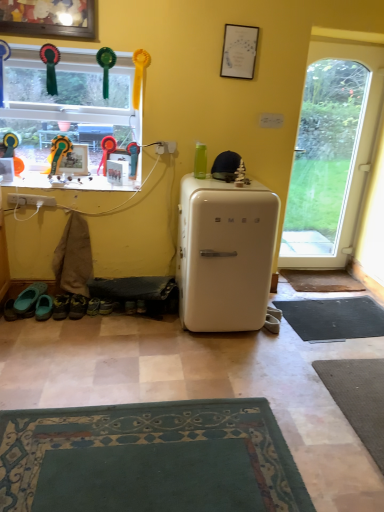
The image size is (384, 512). Find the location of `glass window at upper left`. glass window at upper left is located at coordinates (67, 112).

Measure the distance between point (131, 159) and camera.

The distance of point (131, 159) from camera is 3.19 meters.

The height and width of the screenshot is (512, 384). What do you see at coordinates (225, 254) in the screenshot?
I see `white matte refrigerator at center` at bounding box center [225, 254].

This screenshot has width=384, height=512. Find the location of `rubber ribbon at upper left, the 2th toy in the right-to-left sequence`. rubber ribbon at upper left, the 2th toy in the right-to-left sequence is located at coordinates (106, 151).

Locate an element on the screen. The image size is (384, 512). transparent glass door at right is located at coordinates (331, 151).

From the image's perspective, which is above, green fabric shoe at lower left, which is the first shoe in right-to-left order, or black rubber doormat at lower right?

green fabric shoe at lower left, which is the first shoe in right-to-left order, from the image's perspective.

Is green fabric shoe at lower left, the 2th shoe when ordered from left to right, aimed at black rubber doormat at lower right?

No, green fabric shoe at lower left, the 2th shoe when ordered from left to right, is not turned towards black rubber doormat at lower right.

From a real-world perspective, is green fabric shoe at lower left, which is the first shoe in right-to-left order, physically below black rubber doormat at lower right?

No, from a real-world perspective, green fabric shoe at lower left, which is the first shoe in right-to-left order, is not below black rubber doormat at lower right.

Between green fabric shoe at lower left, which is the first shoe in right-to-left order, and black rubber doormat at lower right, which one has less height?

black rubber doormat at lower right is shorter.

Which point is more distant from viewer, (281,274) or (67,153)?

Point (281,274)

What's the angular difference between brown textured mat at lower right and wooden photo frame at upper left, the 2th picture frame in the front-to-back sequence,'s facing directions?

The facing directions of brown textured mat at lower right and wooden photo frame at upper left, the 2th picture frame in the front-to-back sequence, are 0.535 degrees apart.

How much distance is there between brown textured mat at lower right and wooden photo frame at upper left, which is counted as the second picture frame, starting from the top?

brown textured mat at lower right is 6.91 feet from wooden photo frame at upper left, which is counted as the second picture frame, starting from the top.

Which of these two, brown textured mat at lower right or wooden photo frame at upper left, which is counted as the second picture frame, starting from the top, is thinner?

wooden photo frame at upper left, which is counted as the second picture frame, starting from the top, is thinner.

Does green rubber clogs at lower left, arranged as the first footwear when viewed from the left, lie behind green fabric shoe at lower left, which is the first shoe in right-to-left order?

That is False.

Between point (41, 282) and point (145, 311), which one is positioned behind?

Point (41, 282)

Could green fabric shoe at lower left, which is the first shoe in right-to-left order, be considered to be inside green rubber clogs at lower left, the third footwear positioned from the right?

No, green fabric shoe at lower left, which is the first shoe in right-to-left order, is located outside of green rubber clogs at lower left, the third footwear positioned from the right.

Based on the photo, looking at their sizes, would you say green rubber clogs at lower left, arranged as the first footwear when viewed from the left, is wider or thinner than green fabric shoe at lower left, which is the first shoe in right-to-left order?

Considering their sizes, green rubber clogs at lower left, arranged as the first footwear when viewed from the left, looks broader than green fabric shoe at lower left, which is the first shoe in right-to-left order.

Considering the sizes of objects teal fabric shoes at lower left, arranged as the second footwear when viewed from the left, and metallic green ribbon at upper left, acting as the third toy starting from the right, in the image provided, who is bigger, teal fabric shoes at lower left, arranged as the second footwear when viewed from the left, or metallic green ribbon at upper left, acting as the third toy starting from the right,?

metallic green ribbon at upper left, acting as the third toy starting from the right, is bigger.

Looking at this image, is teal fabric shoes at lower left, which is counted as the second footwear, starting from the right, facing away from metallic green ribbon at upper left, acting as the third toy starting from the right?

teal fabric shoes at lower left, which is counted as the second footwear, starting from the right, is not turned away from metallic green ribbon at upper left, acting as the third toy starting from the right.

This screenshot has height=512, width=384. I want to click on the 3rd footwear located beneath the metallic green ribbon at upper left, acting as the third toy starting from the right (from a real-world perspective), so click(44, 307).

Measure the distance from transparent glass door at right to black rubber doormat at lower right.

The distance of transparent glass door at right from black rubber doormat at lower right is 4.04 feet.

From a real-world perspective, which is physically above, transparent glass door at right or black rubber doormat at lower right?

In real-world perspective, transparent glass door at right is above.

Are transparent glass door at right and black rubber doormat at lower right making contact?

transparent glass door at right is not next to black rubber doormat at lower right, and they're not touching.

Is point (307, 148) closer to viewer compared to point (298, 322)?

No, it is not.

From the image's perspective, between black rubber doormat at lower right and teal fabric shoes at lower left, which is counted as the second footwear, starting from the right, which one is located above?

teal fabric shoes at lower left, which is counted as the second footwear, starting from the right.

Which is more to the right, black rubber doormat at lower right or teal fabric shoes at lower left, which is counted as the second footwear, starting from the right?

Positioned to the right is black rubber doormat at lower right.

Is black rubber doormat at lower right bigger or smaller than teal fabric shoes at lower left, arranged as the second footwear when viewed from the left?

In the image, black rubber doormat at lower right appears to be larger than teal fabric shoes at lower left, arranged as the second footwear when viewed from the left.

Looking at this image, are black rubber doormat at lower right and teal fabric shoes at lower left, arranged as the second footwear when viewed from the left, located far from each other?

black rubber doormat at lower right is positioned a significant distance from teal fabric shoes at lower left, arranged as the second footwear when viewed from the left.

Is white matte refrigerator at center far away from transparent glass door at right?

Absolutely, white matte refrigerator at center is distant from transparent glass door at right.

Based on their positions, is white matte refrigerator at center located to the left or right of transparent glass door at right?

white matte refrigerator at center is to the left of transparent glass door at right.

Is white matte refrigerator at center wider than transparent glass door at right?

Yes, white matte refrigerator at center is wider than transparent glass door at right.

From a real-world perspective, relative to transparent glass door at right, is white matte refrigerator at center vertically above or below?

From a real-world perspective, white matte refrigerator at center is physically below transparent glass door at right.

Locate an element on the screen. This screenshot has width=384, height=512. the 1st shoe to the left of the black rubber doormat at lower right, counting from the anchor's position is located at coordinates (141, 306).

Identify the location of picture frame that is the 1st one above the brown textured mat at lower right (from a real-world perspective). The image size is (384, 512). (74, 161).

Estimate the real-world distances between objects in this image. Which object is closer to brown textured mat at lower right, teal rubber shoe at lower left, the 1th shoe from the left, or teal fabric shoes at lower left, which is counted as the second footwear, starting from the right?

teal fabric shoes at lower left, which is counted as the second footwear, starting from the right, is closer to brown textured mat at lower right.

When comparing their distances from wooden photo frame at upper left, the 1th picture frame when ordered from bottom to top, does teal rubber shoe at lower left, the 1th shoe from the left, or matte white picture frame at upper center, the second picture frame in the bottom-to-top sequence, seem closer?

Based on the image, teal rubber shoe at lower left, the 1th shoe from the left, appears to be nearer to wooden photo frame at upper left, the 1th picture frame when ordered from bottom to top.

Looking at the image, which one is located further to wooden photo frame at upper left, acting as the 2th picture frame starting from the right, rubberized plastic toy at upper center, the 3th toy viewed from the left, or brown textured mat at lower right?

The object further to wooden photo frame at upper left, acting as the 2th picture frame starting from the right, is brown textured mat at lower right.

Estimate the real-world distances between objects in this image. Which object is further from rubberized plastic toy at upper center, the 3th toy viewed from the left, transparent glass door at right or teal rubber shoe at lower left, the 1th shoe from the left?

transparent glass door at right is further to rubberized plastic toy at upper center, the 3th toy viewed from the left.

Looking at the image, which one is located further to green fabric shoe at lower left, which is the first shoe in right-to-left order, matte white picture frame at upper center, arranged as the first picture frame when viewed from the front, or brown textured mat at lower right?

matte white picture frame at upper center, arranged as the first picture frame when viewed from the front, is further to green fabric shoe at lower left, which is the first shoe in right-to-left order.

When comparing their distances from black rubber doormat at lower right, does wooden photo frame at upper left, the 1th picture frame when ordered from bottom to top, or glass window at upper left seem closer?

glass window at upper left.

From the image, which object appears to be farther from white matte refrigerator at center, matte white picture frame at upper center, arranged as the first picture frame when viewed from the front, or rubberized plastic toy at upper center, the 3th toy viewed from the left?

The object further to white matte refrigerator at center is matte white picture frame at upper center, arranged as the first picture frame when viewed from the front.

Considering their positions, is matte white picture frame at upper center, the 2th picture frame in the back-to-front sequence, positioned closer to metallic green ribbon at upper left, acting as the third toy starting from the right, than black rubber doormat at lower right?

The object closer to metallic green ribbon at upper left, acting as the third toy starting from the right, is matte white picture frame at upper center, the 2th picture frame in the back-to-front sequence.

The image size is (384, 512). What are the coordinates of `refrigerator located between brown leather shoes at lower left, which ranks as the third footwear in left-to-right order, and brown textured mat at lower right in the left-right direction` in the screenshot? It's located at (225, 254).

In order to click on window situated between metallic green ribbon at upper left, acting as the third toy starting from the right, and transparent glass door at right from left to right in this screenshot , I will do `click(67, 112)`.

The image size is (384, 512). Identify the location of shoe between wooden photo frame at upper left, the 1th picture frame when ordered from left to right, and black rubber doormat at lower right from left to right. pyautogui.click(x=141, y=306).

Where is `shoe between glass window at upper left and brown textured mat at lower right from left to right`? The width and height of the screenshot is (384, 512). shoe between glass window at upper left and brown textured mat at lower right from left to right is located at coordinates (141, 306).